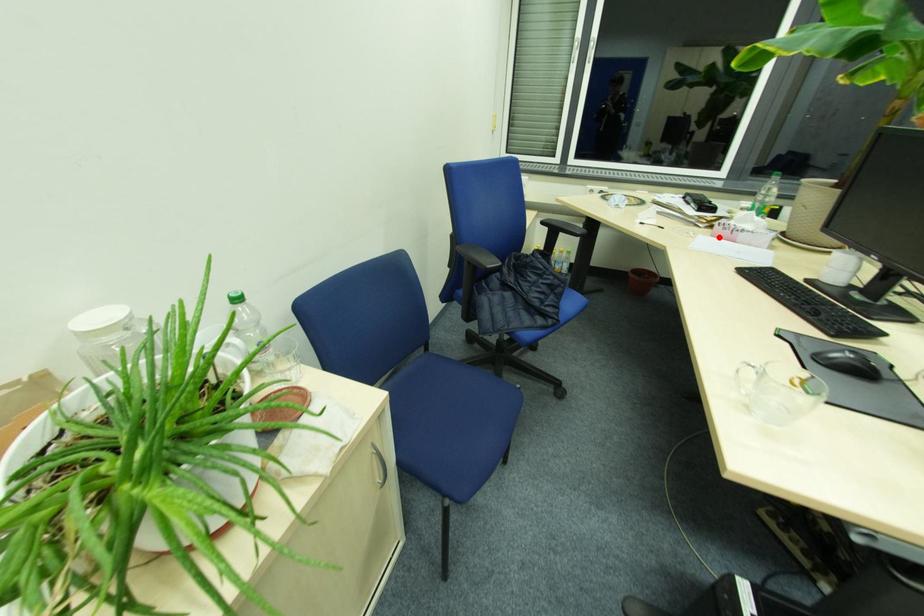
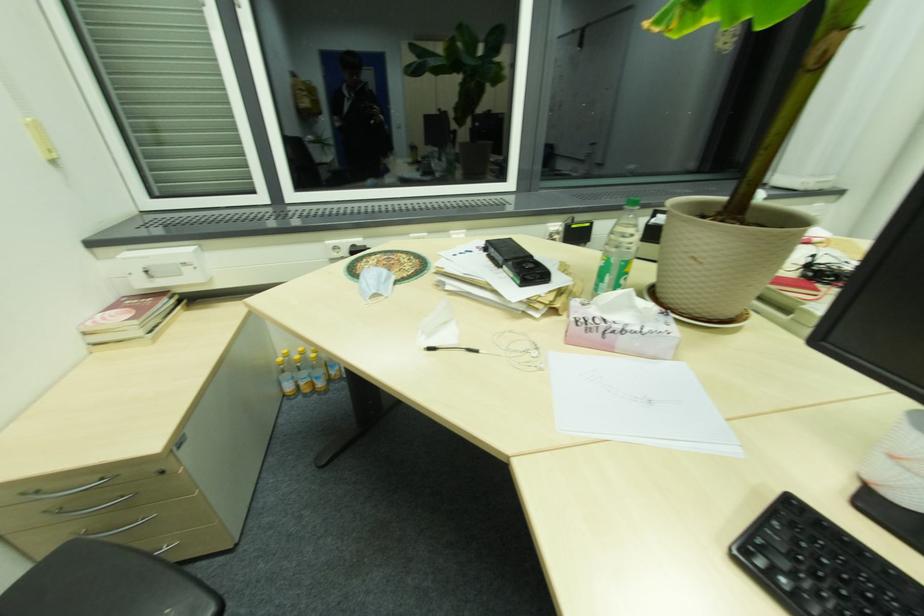
Where in the second image is the point corresponding to the highlighted location from the first image?

(575, 342)